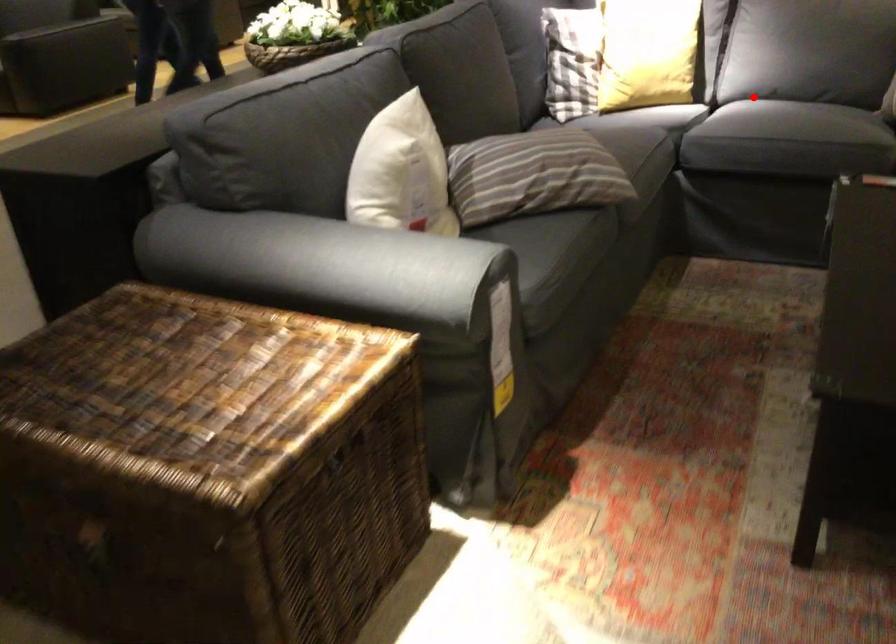
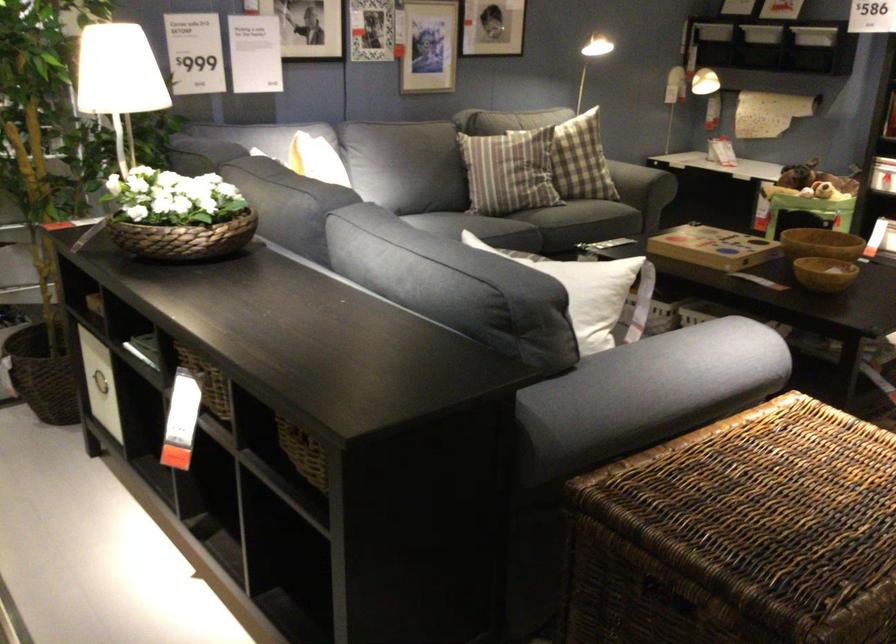
The point at the highlighted location is marked in the first image. Where is the corresponding point in the second image?

(484, 227)